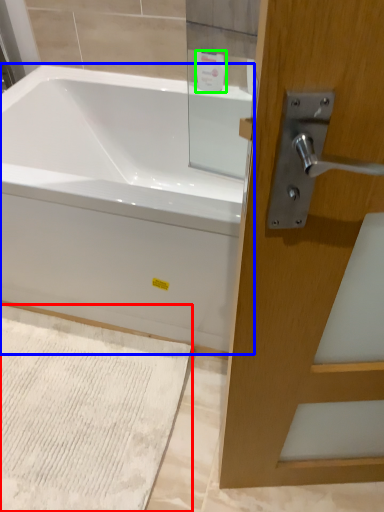
Question: Which object is the closest to the bath mat (highlighted by a red box)? Choose among these: bathtub (highlighted by a blue box) or toiletry (highlighted by a green box).

Choices:
 (A) bathtub
 (B) toiletry

Answer: (A)